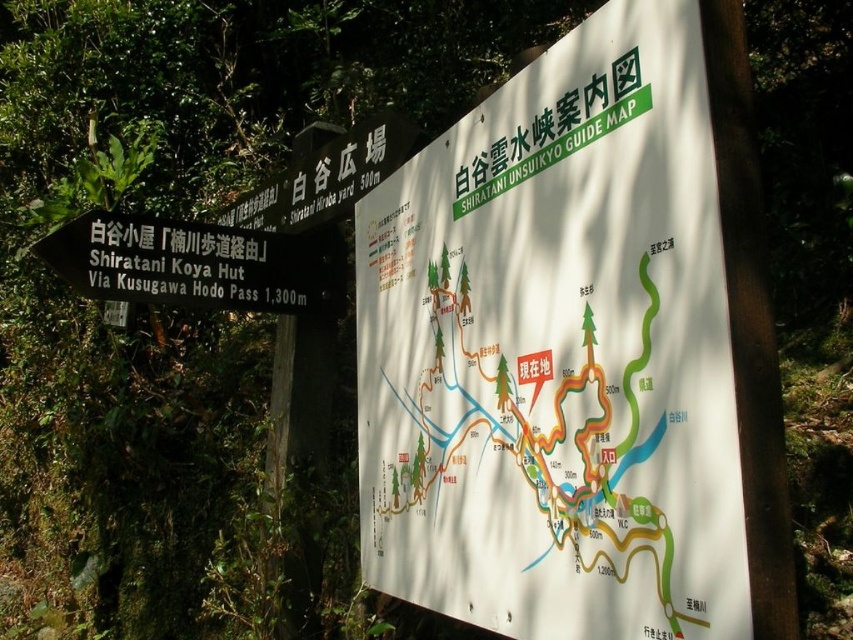
You are a hiker with a 30 inch long hiking pole. You want to check the white matte guide map at center while holding your pole horizontally in front of you. Can you do so without the pole touching the map?

The white matte guide map at center is 29.95 inches away from camera. Since your hiking pole is 30 inches long, holding it horizontally in front of you would mean the pole extends beyond the map, so it would touch the map. Therefore, you cannot check the map without the pole touching it.

You are a hiker trying to read both the white matte guide map at center and the black plastic sign at left. Which object would you need to move closer to in order to read the text more clearly?

The white matte guide map at center is thinner than the black plastic sign at left, so you would need to move closer to the white matte guide map at center to read its text more clearly since thinner objects may have smaller text or details that require closer inspection.

You are a hiker trying to navigate using the signboard. You see the white matte guide map at center and the black plastic sign at left. Which object should you look at first to get an overview of the entire trail map?

The white matte guide map at center is positioned on the right side of the black plastic sign at left, so you should look at the white matte guide map at center first to get an overview of the entire trail map because it is the map section of the signboard.